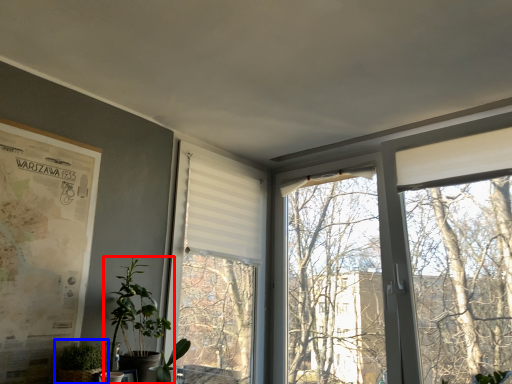
Question: Which point is closer to the camera, houseplant (highlighted by a red box) or houseplant (highlighted by a blue box)?

Choices:
 (A) houseplant
 (B) houseplant

Answer: (B)